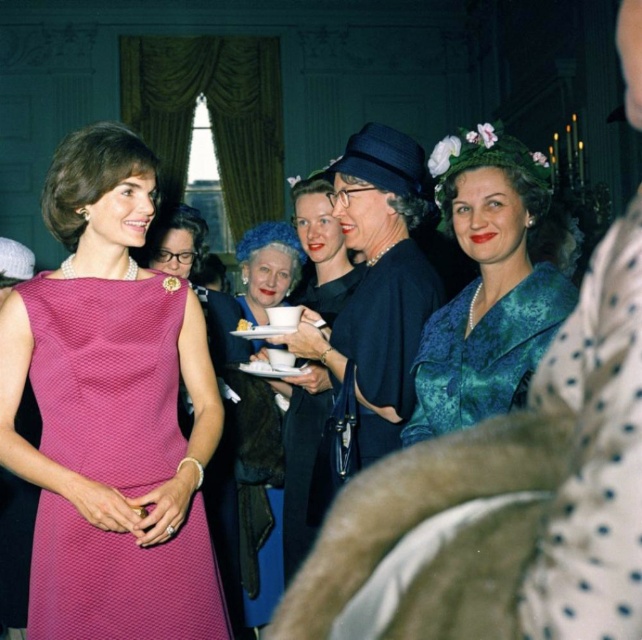
You are at a formal event and see two women in velvet dresses. One is wearing a teal velvet dress at center and the other a velvet black dress at center. Which one is standing to the right of the other?

The teal velvet dress at center is positioned on the right side of velvet black dress at center.

You are a photographer at the event and want to take a photo of both the pink textured dress at center and the velvet black dress at center. Since you can only focus on one subject at a time, which dress should you focus on to ensure the other is still visible in the background?

You should focus on the pink textured dress at center because it is in front of the velvet black dress at center, so the velvet black dress at center will be in the background and still visible.